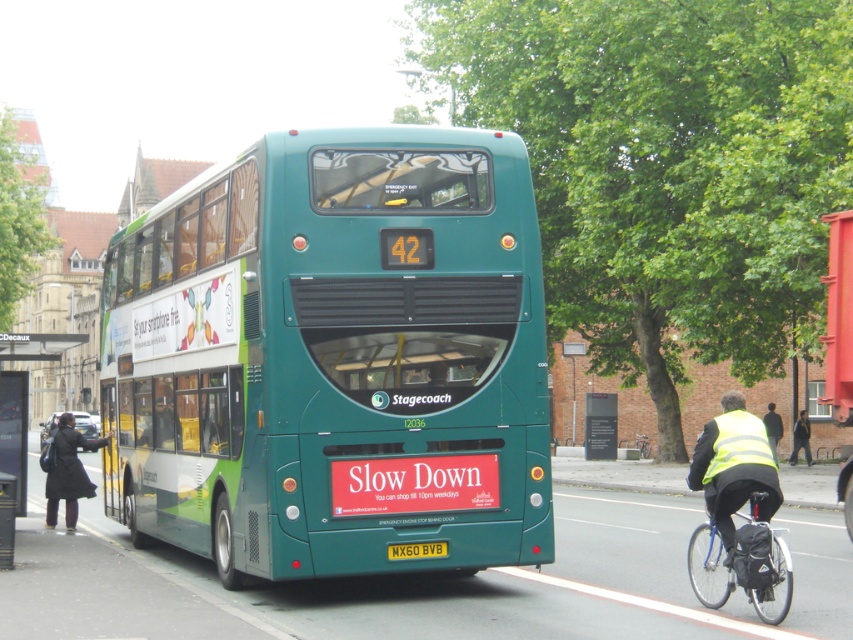
Question: Does black plastic bus stop at lower left have a lesser width compared to yellow metallic license plate at center?

Choices:
 (A) yes
 (B) no

Answer: (B)

Question: Is high visibility yellow vest at lower right further to camera compared to yellow metallic license plate at center?

Choices:
 (A) yes
 (B) no

Answer: (B)

Question: Which of the following is the farthest from the observer?

Choices:
 (A) green matte bus at center
 (B) dark blue jeans at lower right
 (C) dark green coat at lower left

Answer: (B)

Question: Which point is farther to the camera?

Choices:
 (A) black plastic bus stop at lower left
 (B) yellow metallic license plate at center
 (C) high visibility yellow vest at lower right

Answer: (A)

Question: Can you confirm if high visibility yellow vest at lower right is positioned above dark blue jeans at lower right?

Choices:
 (A) yes
 (B) no

Answer: (A)

Question: Estimate the real-world distances between objects in this image. Which object is farther from the yellow metallic license plate at center?

Choices:
 (A) reflective yellow vest at right
 (B) dark blue jeans at lower right

Answer: (B)